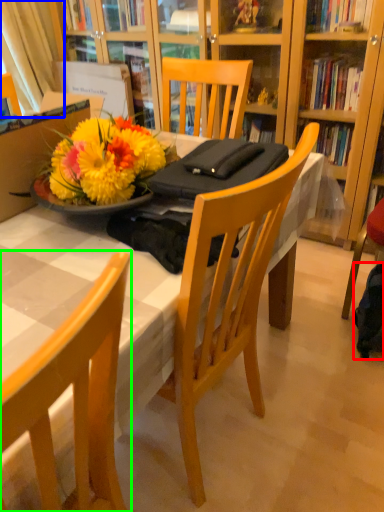
Question: Estimate the real-world distances between objects in this image. Which object is farther from backpack (highlighted by a red box), curtain (highlighted by a blue box) or chair (highlighted by a green box)?

Choices:
 (A) curtain
 (B) chair

Answer: (A)